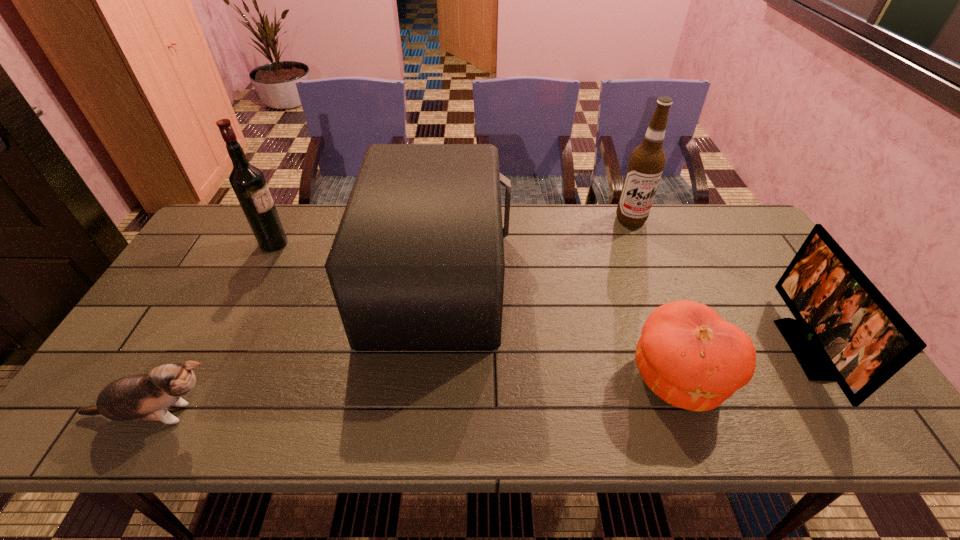
Find the location of a particular element. The height and width of the screenshot is (540, 960). vacant area that lies between the monitor and the wine bottle is located at coordinates (539, 296).

Where is `vacant space that's between the microwave oven and the cat`? The width and height of the screenshot is (960, 540). vacant space that's between the microwave oven and the cat is located at coordinates (297, 347).

In order to click on free area in between the rightmost object and the alcohol in this screenshot , I will do `click(717, 284)`.

The width and height of the screenshot is (960, 540). Find the location of `free space between the alcohol and the pumpkin`. free space between the alcohol and the pumpkin is located at coordinates tap(654, 299).

Find the location of a particular element. unoccupied area between the monitor and the third object from left to right is located at coordinates (620, 314).

Locate an element on the screen. This screenshot has width=960, height=540. vacant area that lies between the third object from left to right and the monitor is located at coordinates (620, 314).

This screenshot has height=540, width=960. What are the coordinates of `unoccupied position between the cat and the third object from left to right` in the screenshot? It's located at (297, 347).

Locate which object is the fourth closest to the microwave oven. Please provide its 2D coordinates. Your answer should be formatted as a tuple, i.e. [(x, y)], where the tuple contains the x and y coordinates of a point satisfying the conditions above.

[(647, 161)]

Locate an element on the screen. This screenshot has height=540, width=960. object that is the fifth closest one to the wine bottle is located at coordinates [845, 330].

Where is `vacant region that satisfies the following two spatial constraints: 1. on the front and back of the pumpkin; 2. on the left side of the wine bottle`? vacant region that satisfies the following two spatial constraints: 1. on the front and back of the pumpkin; 2. on the left side of the wine bottle is located at coordinates (205, 379).